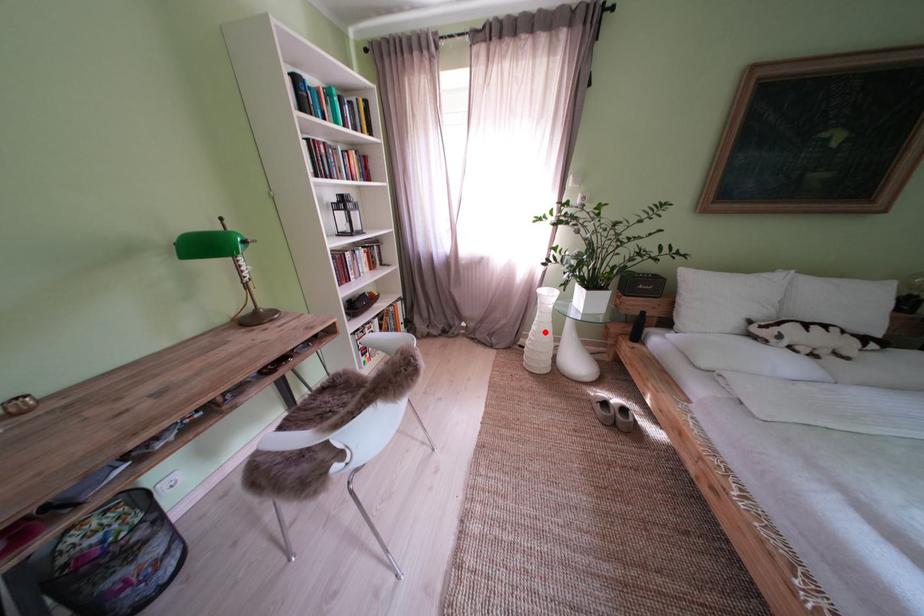
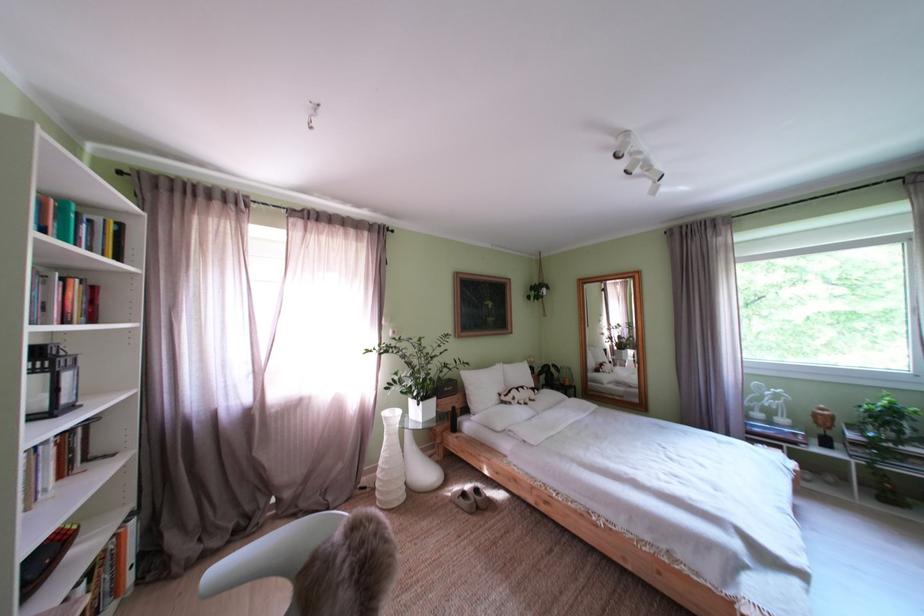
Question: I am providing you with two images of the same scene from different viewpoints. Given a red point in image1, look at the same physical point in image2. Is it:

Choices:
 (A) Closer to the viewpoint
 (B) Farther from the viewpoint

Answer: (B)